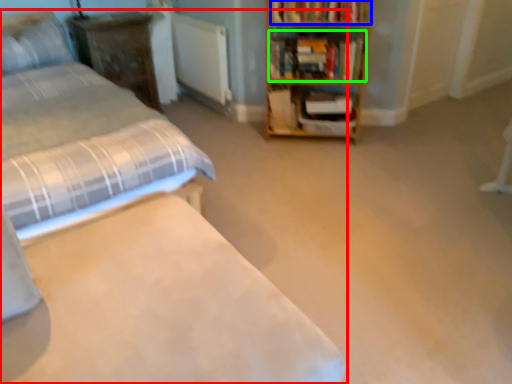
Question: Based on their relative distances, which object is nearer to bed (highlighted by a red box)? Choose from book (highlighted by a blue box) and book (highlighted by a green box).

Choices:
 (A) book
 (B) book

Answer: (B)